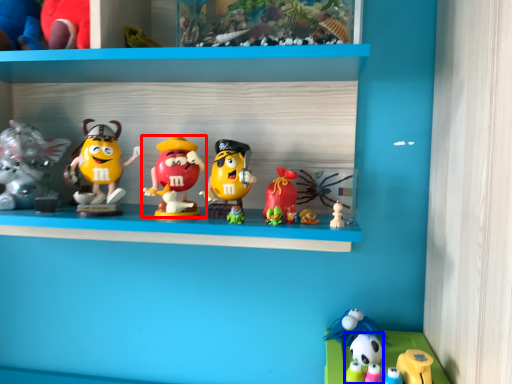
Question: Which of the following is the farthest to the observer, toy (highlighted by a red box) or toy (highlighted by a blue box)?

Choices:
 (A) toy
 (B) toy

Answer: (A)